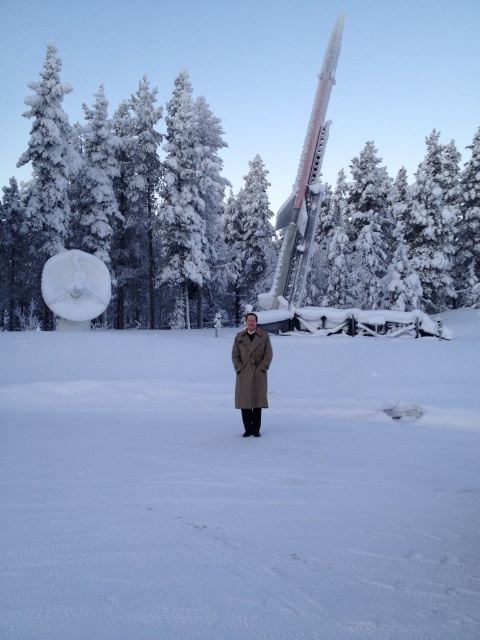
Question: Among these points, which one is farthest from the camera?

Choices:
 (A) (425, 157)
 (B) (141, 429)
 (C) (238, 394)

Answer: (A)

Question: Based on their relative distances, which object is nearer to the white powdery snow at center?

Choices:
 (A) shiny metallic rocket at center
 (B) white snow-covered tree at upper center

Answer: (A)

Question: Is white snow-covered tree at upper center to the left of shiny metallic rocket at center from the viewer's perspective?

Choices:
 (A) yes
 (B) no

Answer: (A)

Question: Does white snow-covered tree at upper center appear on the left side of shiny metallic rocket at center?

Choices:
 (A) no
 (B) yes

Answer: (B)

Question: Is the position of white powdery snow at center less distant than that of shiny metallic rocket at center?

Choices:
 (A) no
 (B) yes

Answer: (B)

Question: Among these points, which one is nearest to the camera?

Choices:
 (A) (358, 193)
 (B) (248, 358)
 (C) (286, 234)

Answer: (B)